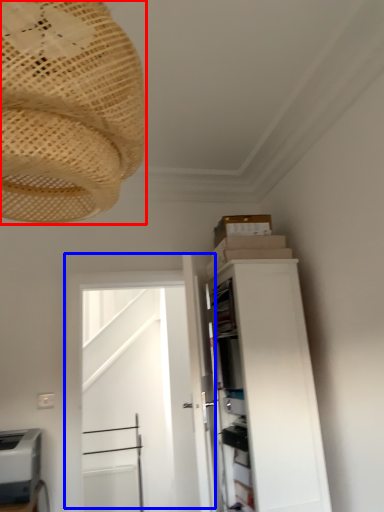
Question: Among these objects, which one is nearest to the camera, lamp (highlighted by a red box) or door (highlighted by a blue box)?

Choices:
 (A) lamp
 (B) door

Answer: (A)